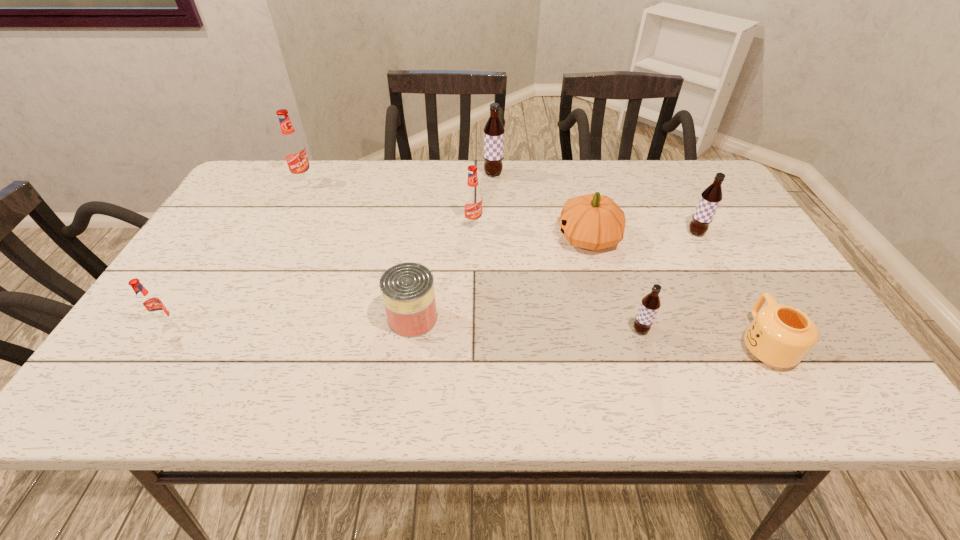
The width and height of the screenshot is (960, 540). I want to click on the third root beer from right to left, so click(x=494, y=130).

Image resolution: width=960 pixels, height=540 pixels. I want to click on the fifth object from right to left, so click(x=494, y=130).

Find the location of a particular element. The image size is (960, 540). the farthest red root beer is located at coordinates (293, 148).

Image resolution: width=960 pixels, height=540 pixels. I want to click on the second red root beer from right to left, so click(293, 148).

Locate an element on the screen. The width and height of the screenshot is (960, 540). the rightmost red root beer is located at coordinates (472, 197).

Where is `the third root beer from left to right`? The image size is (960, 540). the third root beer from left to right is located at coordinates (472, 197).

You are a GUI agent. You are given a task and a screenshot of the screen. Output one action in this format:
    pyautogui.click(x=<x>, y=<y>)
    Task: Click on the rightmost root beer
    The height and width of the screenshot is (540, 960).
    Given the screenshot: What is the action you would take?
    pyautogui.click(x=711, y=197)

Locate an element on the screen. The width and height of the screenshot is (960, 540). the second smallest brown root beer is located at coordinates (711, 197).

Where is `orange gourd`? This screenshot has height=540, width=960. orange gourd is located at coordinates (593, 221).

Identify the location of the smallest brown root beer. The image size is (960, 540). (650, 304).